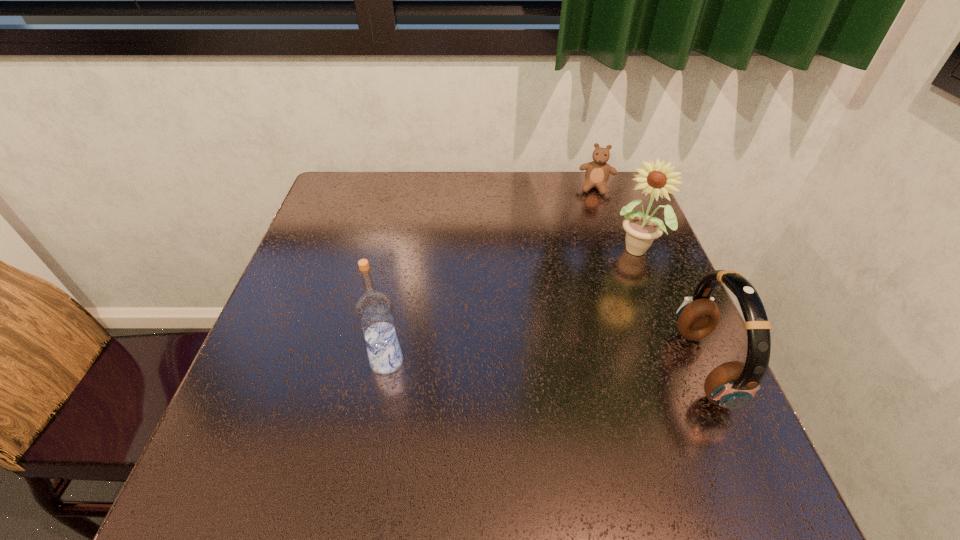
This screenshot has width=960, height=540. What are the coordinates of `vacant space on the desktop that is between the vodka and the headset and is positioned on the front-facing side of the third nearest object` in the screenshot? It's located at (562, 364).

Identify the location of free space on the desktop that is between the vodka and the headset and is positioned on the front-facing side of the farthest object. (569, 364).